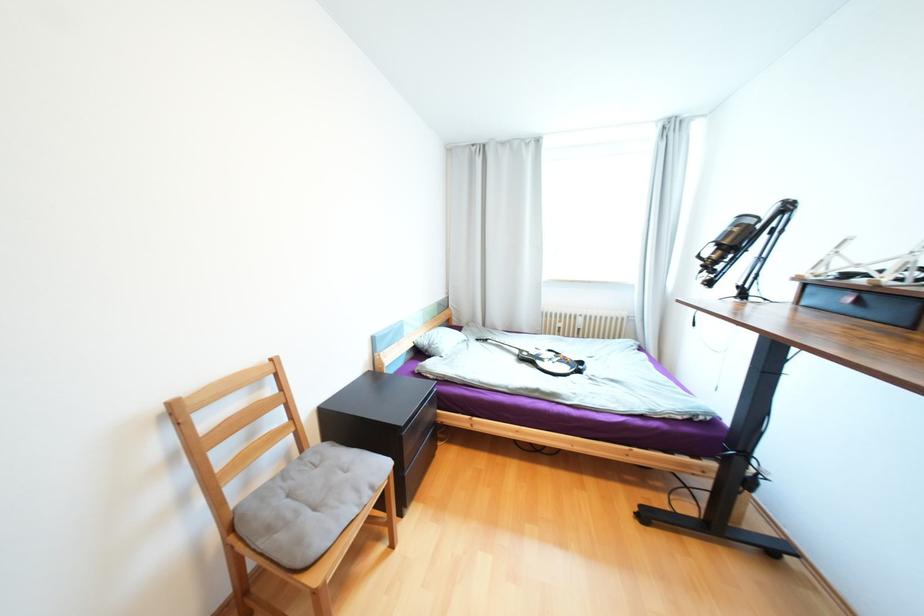
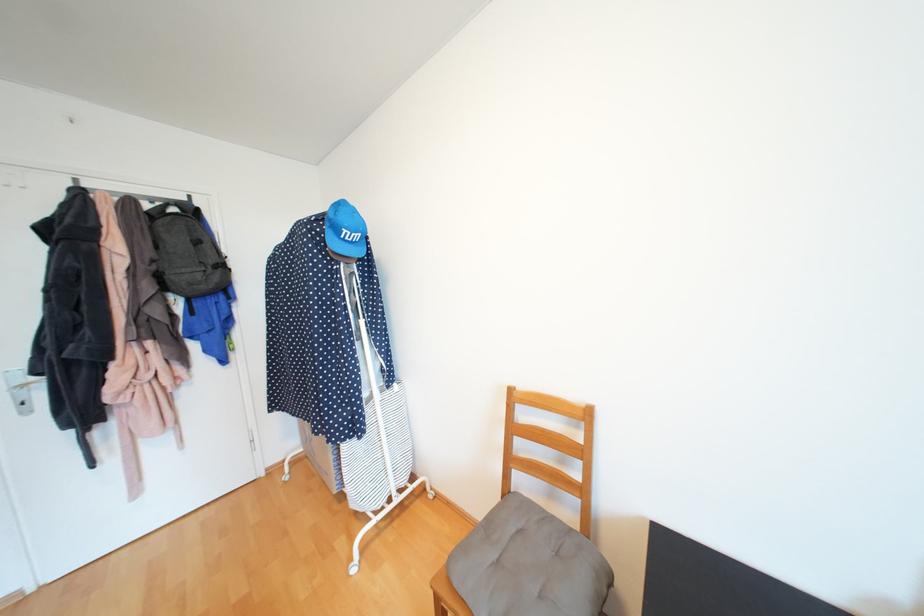
Question: Based on the continuous images, in which direction is the camera rotating? Reply with the corresponding letter.

Choices:
 (A) Left
 (B) Right
 (C) Up
 (D) Down

Answer: (A)